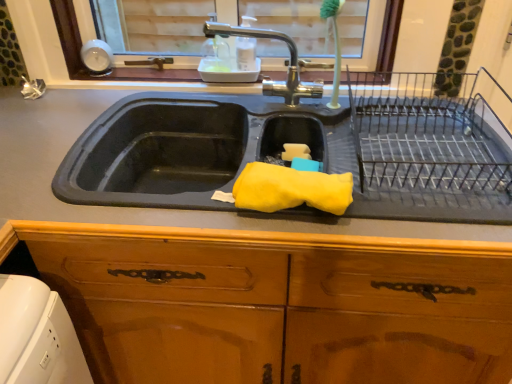
Question: Would you consider rubber yellow sponge at center to be distant from polished chrome faucet at upper center?

Choices:
 (A) yes
 (B) no

Answer: (B)

Question: Is rubber yellow sponge at center shorter than polished chrome faucet at upper center?

Choices:
 (A) no
 (B) yes

Answer: (A)

Question: Could you tell me if rubber yellow sponge at center is facing polished chrome faucet at upper center?

Choices:
 (A) no
 (B) yes

Answer: (A)

Question: From the image's perspective, is rubber yellow sponge at center above polished chrome faucet at upper center?

Choices:
 (A) yes
 (B) no

Answer: (B)

Question: Is rubber yellow sponge at center at the left side of polished chrome faucet at upper center?

Choices:
 (A) yes
 (B) no

Answer: (B)

Question: From the image's perspective, is yellow sponge at sink located above or below rubber yellow sponge at center?

Choices:
 (A) below
 (B) above

Answer: (A)

Question: Based on their positions, is yellow sponge at sink located to the left or right of rubber yellow sponge at center?

Choices:
 (A) left
 (B) right

Answer: (B)

Question: Considering their positions, is yellow sponge at sink located in front of or behind rubber yellow sponge at center?

Choices:
 (A) behind
 (B) front

Answer: (B)

Question: Is point (240, 187) closer or farther from the camera than point (0, 210)?

Choices:
 (A) farther
 (B) closer

Answer: (B)

Question: Is point click(279, 195) closer or farther from the camera than point click(250, 369)?

Choices:
 (A) farther
 (B) closer

Answer: (B)

Question: In the image, is yellow sponge at sink positioned in front of or behind wooden cabinet at center?

Choices:
 (A) front
 (B) behind

Answer: (B)

Question: In the image, is yellow sponge at sink on the left side or the right side of wooden cabinet at center?

Choices:
 (A) right
 (B) left

Answer: (A)

Question: From a real-world perspective, is yellow sponge at sink physically located above or below wooden cabinet at center?

Choices:
 (A) below
 (B) above

Answer: (B)

Question: From the image's perspective, relative to yellow sponge at sink, is polished chrome faucet at upper center above or below?

Choices:
 (A) below
 (B) above

Answer: (B)

Question: Considering the positions of point (291, 61) and point (283, 168), is point (291, 61) closer or farther from the camera than point (283, 168)?

Choices:
 (A) farther
 (B) closer

Answer: (A)